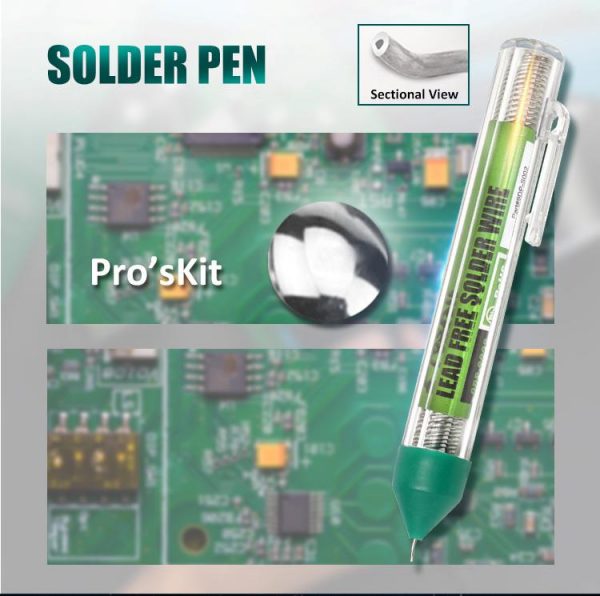
The width and height of the screenshot is (600, 596). What are the coordinates of `wires` in the screenshot? It's located at (237, 370).